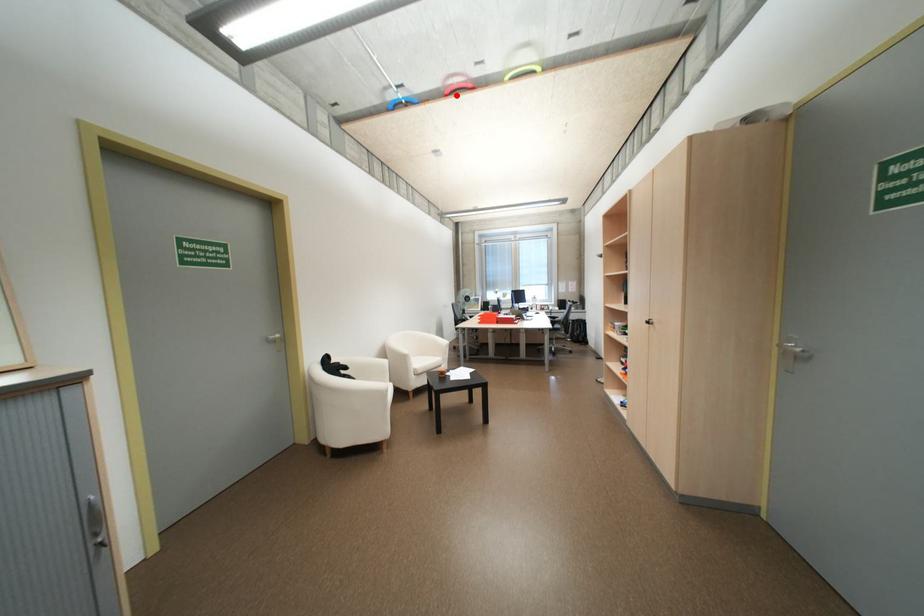
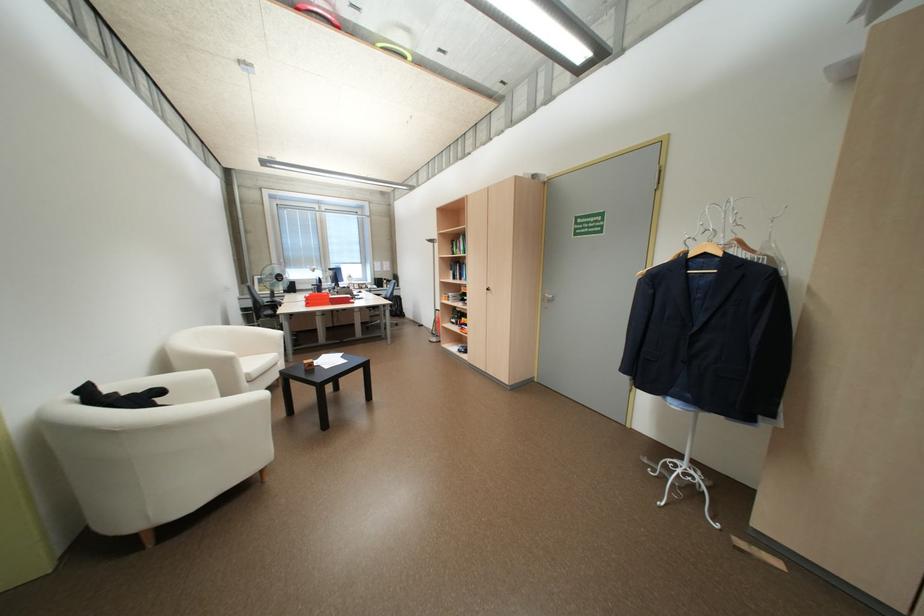
In the second image, find the point that corresponds to the highlighted location in the first image.

(309, 9)